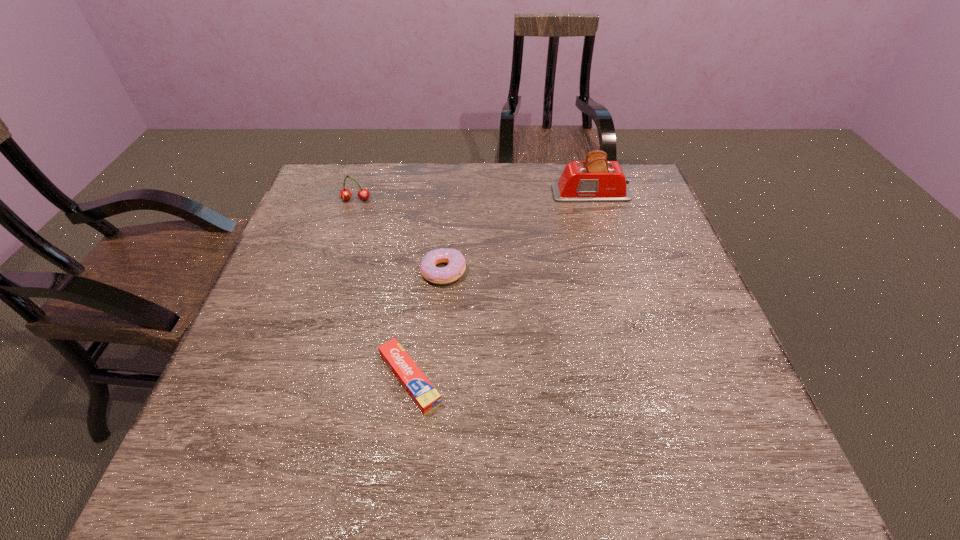
Where is `vacant region that satisfies the following two spatial constraints: 1. with stems pointing upwards on the cherry; 2. on the left side of the third farthest object`? Image resolution: width=960 pixels, height=540 pixels. vacant region that satisfies the following two spatial constraints: 1. with stems pointing upwards on the cherry; 2. on the left side of the third farthest object is located at coordinates pyautogui.click(x=332, y=271).

Image resolution: width=960 pixels, height=540 pixels. I want to click on free spot that satisfies the following two spatial constraints: 1. with stems pointing upwards on the shortest object; 2. on the left side of the leftmost object, so click(298, 379).